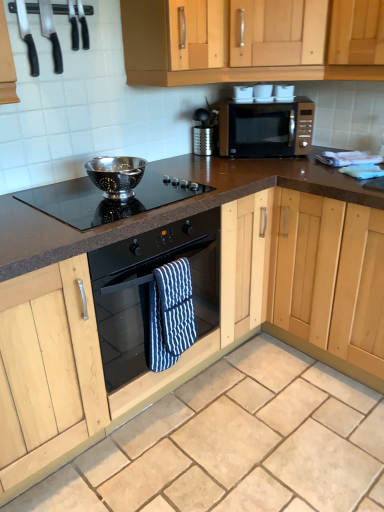
Question: In terms of height, does black glass oven at center look taller or shorter compared to blue striped oven mitt at center?

Choices:
 (A) tall
 (B) short

Answer: (A)

Question: From a real-world perspective, relative to blue striped oven mitt at center, is black glass oven at center vertically above or below?

Choices:
 (A) above
 (B) below

Answer: (A)

Question: Which object is the closest to the matte black oven at center, arranged as the first cabinetry when ordered from the bottom?

Choices:
 (A) black plastic knives at upper left, placed as the 2th appliance when sorted from left to right
 (B) black glass oven at center
 (C) satin gold microwave at upper center
 (D) black plastic knives at upper left, which appears as the 1th appliance when viewed from the left
 (E) beige granite countertop at center

Answer: (B)

Question: Considering the real-world distances, which object is farthest from the beige granite countertop at center?

Choices:
 (A) light wood cabinet at upper center, which appears as the first cabinetry when viewed from the top
 (B) black glass cooktop at center
 (C) black glass oven at center
 (D) black plastic knives at upper left, placed as the 2th appliance when sorted from left to right
 (E) matte black oven at center, arranged as the first cabinetry when ordered from the bottom

Answer: (D)